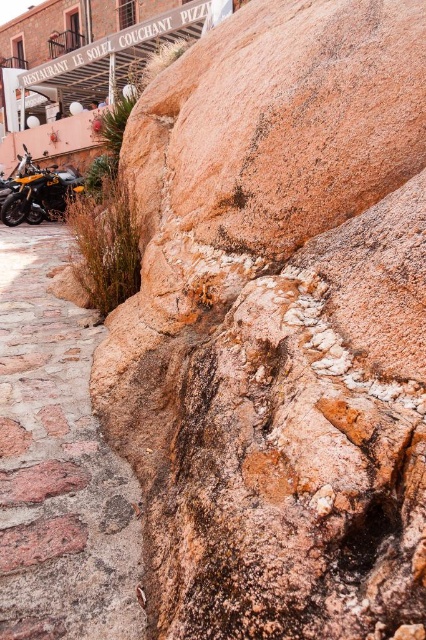
You are standing at the lower left corner of the image and want to reach the orange matte motorcycle at left. Which direction should you move relative to the stone paved path at lower left?

The stone paved path at lower left is below the orange matte motorcycle at left, so you should move upward from the stone paved path at lower left to reach the orange matte motorcycle at left.

You are standing at the lower left corner of the image and want to place a small potted plant on the stone paved path at lower left. However, you notice the orange matte motorcycle at left nearby. Considering their heights, which object should you place the plant on to ensure it is more visible?

The orange matte motorcycle at left has a greater height than the stone paved path at lower left. Therefore, placing the small potted plant on the orange matte motorcycle at left would make it more visible since it is taller.